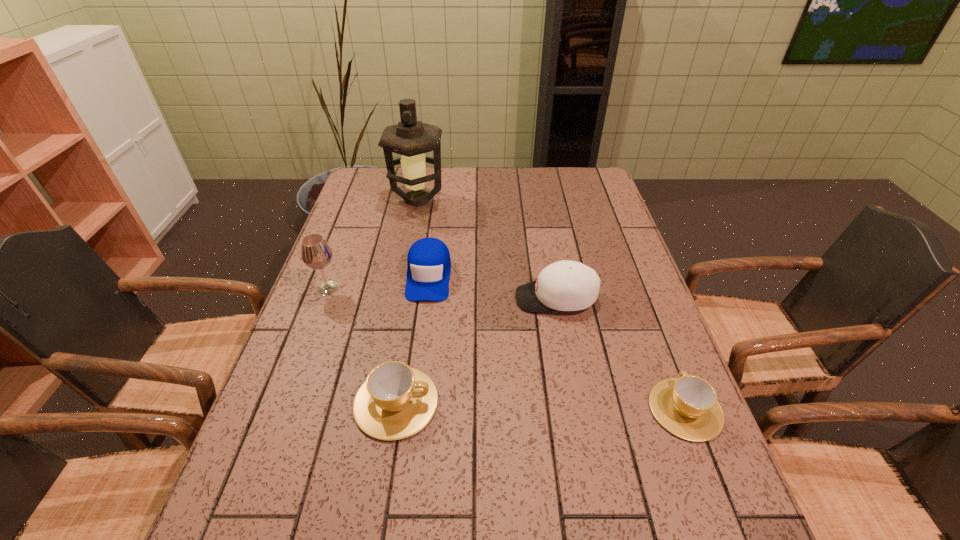
Find the location of a particular element. the left cup is located at coordinates (396, 401).

The height and width of the screenshot is (540, 960). Find the location of `the shorter cup`. the shorter cup is located at coordinates tap(687, 406).

The width and height of the screenshot is (960, 540). What are the coordinates of `the shortest object` in the screenshot? It's located at (687, 406).

Where is `oil lamp`? This screenshot has width=960, height=540. oil lamp is located at coordinates (410, 138).

Identify the location of the farthest object. (410, 138).

Identify the location of wineglass. The height and width of the screenshot is (540, 960). (316, 253).

Where is `the leftmost object`? This screenshot has height=540, width=960. the leftmost object is located at coordinates (316, 253).

Identify the location of the shorter baseball cap. (429, 266).

This screenshot has height=540, width=960. Find the location of `the second object from right to left`. the second object from right to left is located at coordinates (565, 285).

What are the coordinates of `the taller baseball cap` in the screenshot? It's located at (565, 285).